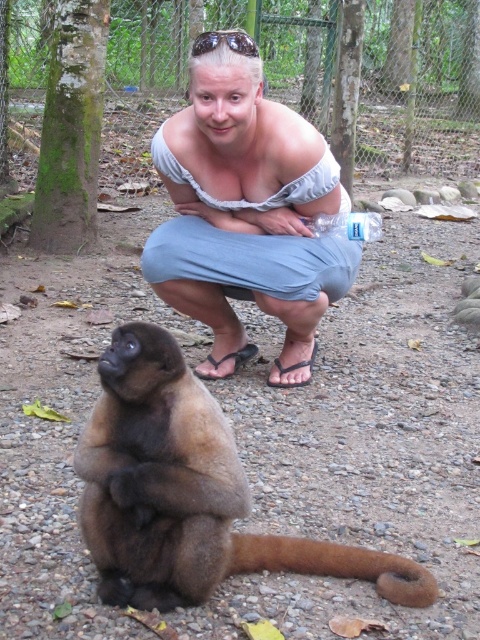
Question: Which point is closer to the camera taking this photo?

Choices:
 (A) (203, 192)
 (B) (397, 580)
 (C) (232, 36)
 (D) (110, 371)

Answer: (D)

Question: Is light blue denim pants at center smaller than transparent plastic goggles at upper center?

Choices:
 (A) yes
 (B) no

Answer: (B)

Question: In this image, where is brown furry monkey at lower left located relative to transparent plastic goggles at upper center?

Choices:
 (A) left
 (B) right

Answer: (A)

Question: Can you confirm if light blue denim pants at center is positioned to the left of transparent plastic goggles at upper center?

Choices:
 (A) no
 (B) yes

Answer: (A)

Question: Which point appears closest to the camera in this image?

Choices:
 (A) (192, 397)
 (B) (398, 595)
 (C) (192, 202)
 (D) (196, 44)

Answer: (A)

Question: Which point is closer to the camera taking this photo?

Choices:
 (A) (290, 545)
 (B) (214, 264)
 (C) (124, 544)

Answer: (C)